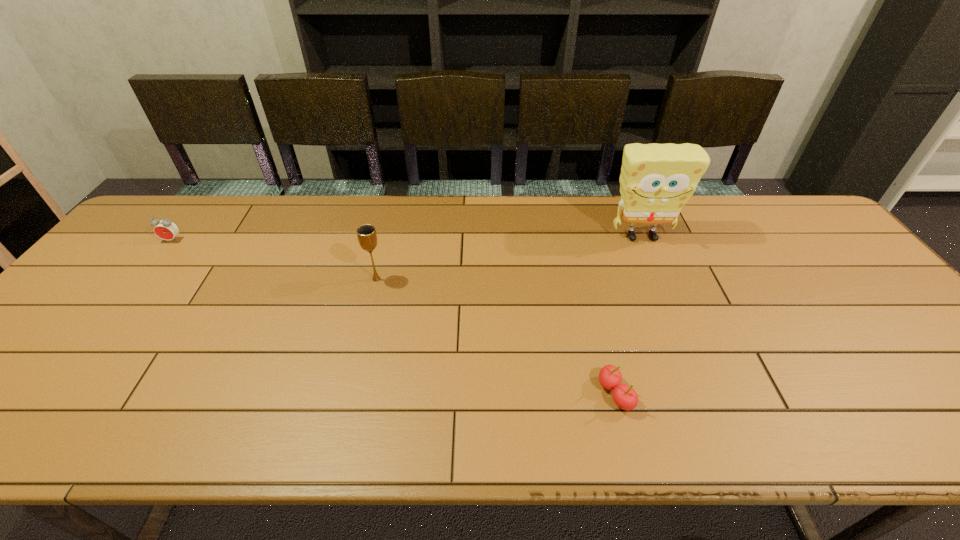
Locate an element on the screen. The width and height of the screenshot is (960, 540). the tallest object is located at coordinates (656, 181).

Image resolution: width=960 pixels, height=540 pixels. I want to click on the rightmost object, so click(x=656, y=181).

This screenshot has height=540, width=960. I want to click on the second object from left to right, so click(x=366, y=234).

The width and height of the screenshot is (960, 540). I want to click on the third farthest object, so click(x=366, y=234).

Find the location of a particular element. the leftmost object is located at coordinates (165, 229).

At what (x,y) coordinates should I click in order to perform the action: click on the third object from left to right. Please return your answer as a coordinate pair (x, y). The height and width of the screenshot is (540, 960). Looking at the image, I should click on (625, 397).

The height and width of the screenshot is (540, 960). What are the coordinates of `cherry` in the screenshot? It's located at (625, 397).

Locate an element on the screen. vacant area located on the face of the rightmost object is located at coordinates (692, 359).

Find the location of a particular element. vacant region located on the back of the chalice is located at coordinates (391, 219).

Where is `vacant region located 0.170m on the face of the leftmost object`? The image size is (960, 540). vacant region located 0.170m on the face of the leftmost object is located at coordinates (138, 284).